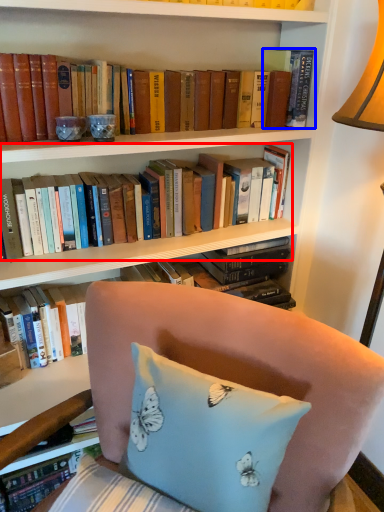
Question: Which of the following is the closest to the observer, book (highlighted by a red box) or book (highlighted by a blue box)?

Choices:
 (A) book
 (B) book

Answer: (A)